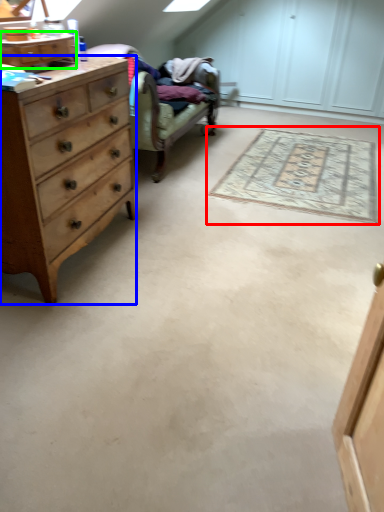
Question: Which object is the closest to the mat (highlighted by a red box)? Choose among these: chest of drawers (highlighted by a blue box) or cabinetry (highlighted by a green box).

Choices:
 (A) chest of drawers
 (B) cabinetry

Answer: (A)